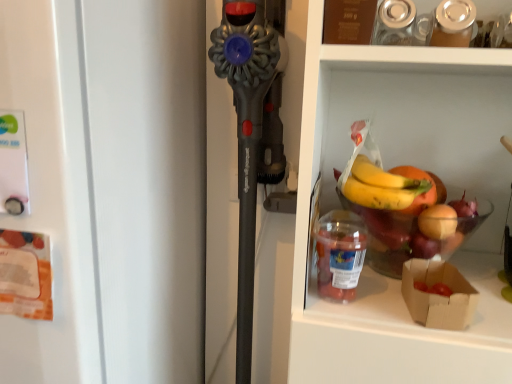
Question: Is brown paper bag at lower right not inside translucent plastic container at lower right?

Choices:
 (A) no
 (B) yes

Answer: (B)

Question: Is translucent plastic container at lower right inside brown paper bag at lower right?

Choices:
 (A) no
 (B) yes

Answer: (A)

Question: Can you confirm if brown paper bag at lower right is wider than translucent plastic container at lower right?

Choices:
 (A) no
 (B) yes

Answer: (B)

Question: From a real-world perspective, does brown paper bag at lower right sit lower than translucent plastic container at lower right?

Choices:
 (A) yes
 (B) no

Answer: (A)

Question: Does brown paper bag at lower right have a lesser height compared to translucent plastic container at lower right?

Choices:
 (A) no
 (B) yes

Answer: (B)

Question: Does brown paper bag at lower right have a larger size compared to translucent plastic container at lower right?

Choices:
 (A) no
 (B) yes

Answer: (A)

Question: Is white matte refrigerator at left a part of translucent plastic container at lower right?

Choices:
 (A) yes
 (B) no

Answer: (B)

Question: Is the depth of translucent plastic container at lower right greater than that of white matte refrigerator at left?

Choices:
 (A) no
 (B) yes

Answer: (B)

Question: Does translucent plastic container at lower right have a smaller size compared to white matte refrigerator at left?

Choices:
 (A) yes
 (B) no

Answer: (A)

Question: Can you confirm if translucent plastic container at lower right is bigger than white matte refrigerator at left?

Choices:
 (A) no
 (B) yes

Answer: (A)

Question: Is translucent plastic container at lower right taller than white matte refrigerator at left?

Choices:
 (A) yes
 (B) no

Answer: (B)

Question: From the image's perspective, is translucent plastic container at lower right over white matte refrigerator at left?

Choices:
 (A) no
 (B) yes

Answer: (B)

Question: Is brown paper bag at lower right surrounded by white matte refrigerator at left?

Choices:
 (A) yes
 (B) no

Answer: (B)